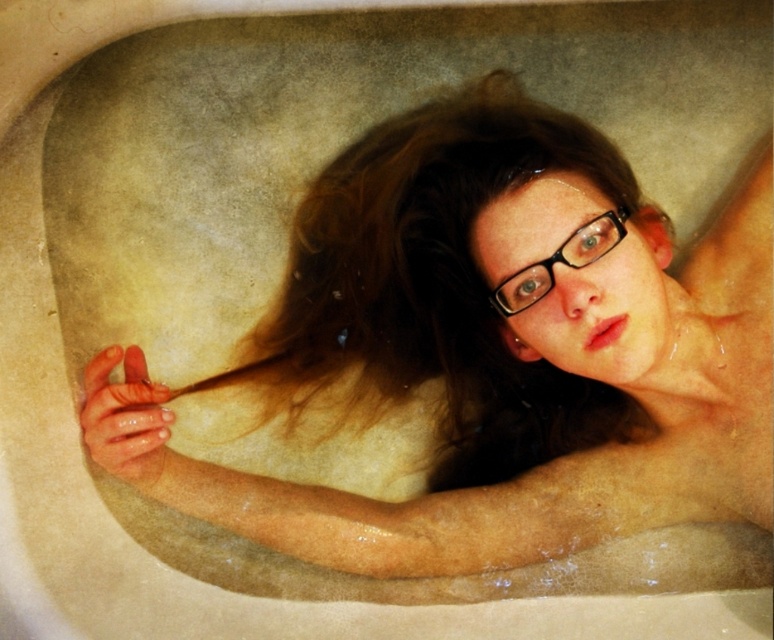
You are a photographer taking a closeup shot of the person in the bathtub. You have two points marked in your viewfinder at coordinates point (473,248) and point (593,236). Which point is closer to your camera lens?

Point (473,248) is closer to the camera lens because it is further to the viewer than point (593,236).

You are a photographer trying to capture a closeup of the smooth skin girl at center and the black plastic glasses at center. Since you want both objects to appear the same size in the photo, which object should you move closer to the camera?

The black plastic glasses at center should be moved closer to the camera because the smooth skin girl at center is larger in size, so bringing the smaller black plastic glasses at center closer will balance their apparent sizes.